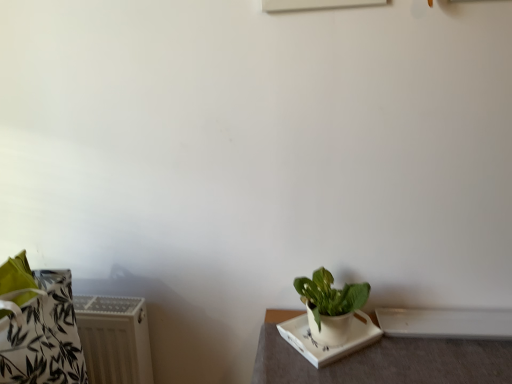
You are a GUI agent. You are given a task and a screenshot of the screen. Output one action in this format:
    pyautogui.click(x=<x>, y=<y>)
    Task: Click on the unoccupied region to the right of white ceramic plate at lower right
    Image resolution: width=512 pixels, height=384 pixels.
    Given the screenshot: What is the action you would take?
    pyautogui.click(x=410, y=357)